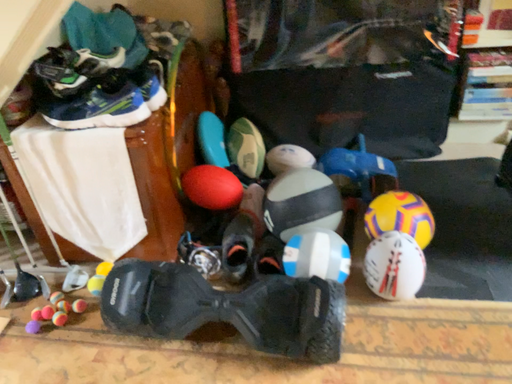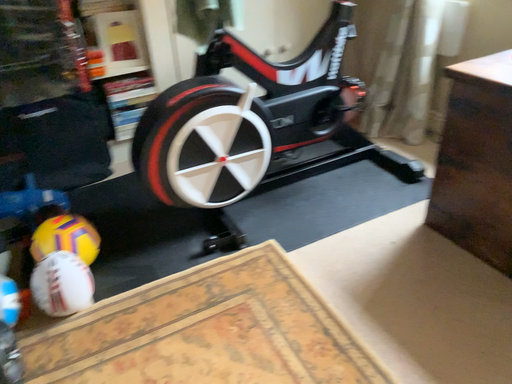
Question: How did the camera likely rotate when shooting the video?

Choices:
 (A) rotated downward
 (B) rotated upward

Answer: (B)